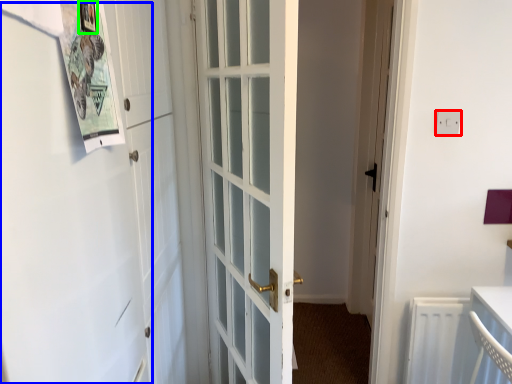
Question: Which object is positioned closest to electric outlet (highlighted by a red box)? Select from barn door (highlighted by a blue box) and picture frame (highlighted by a green box).

Choices:
 (A) barn door
 (B) picture frame

Answer: (B)